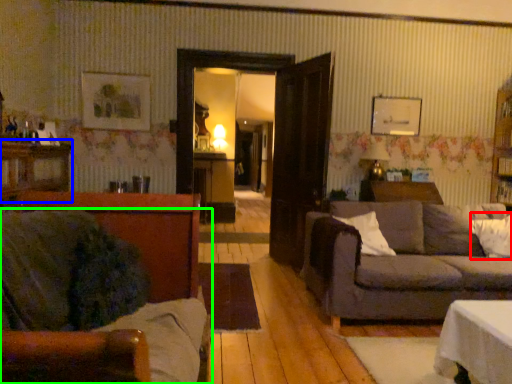
Question: Which object is positioned closest to pillow (highlighted by a red box)? Select from dresser (highlighted by a blue box) and studio couch (highlighted by a green box).

Choices:
 (A) dresser
 (B) studio couch

Answer: (B)